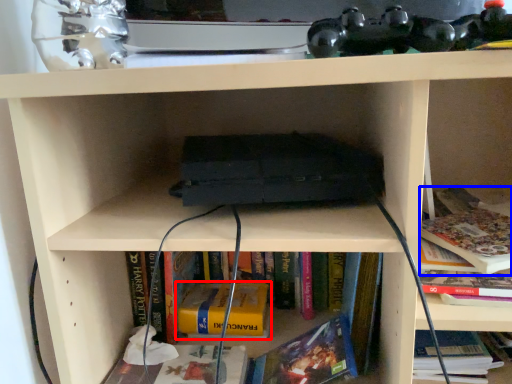
Question: Which of the following is the farthest to the observer, book (highlighted by a red box) or book (highlighted by a blue box)?

Choices:
 (A) book
 (B) book

Answer: (A)